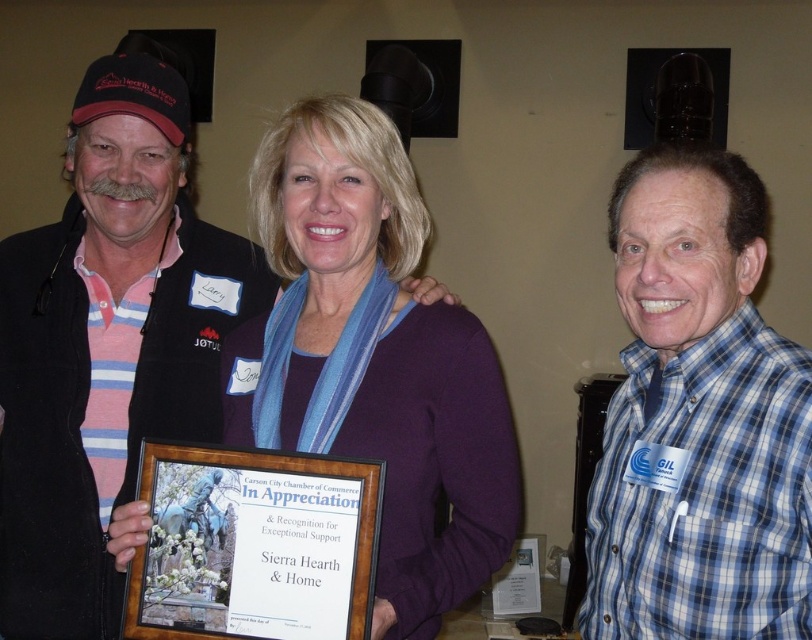
Is blue plaid shirt at right below purple fabric scarf at center?

Correct, blue plaid shirt at right is located below purple fabric scarf at center.

Describe the element at coordinates (698, 419) in the screenshot. The height and width of the screenshot is (640, 812). I see `blue plaid shirt at right` at that location.

The width and height of the screenshot is (812, 640). Identify the location of blue plaid shirt at right. (698, 419).

Between point (217, 276) and point (474, 534), which one is positioned behind?

The point (217, 276) is behind.

Which is in front, point (48, 406) or point (225, 396)?

Positioned in front is point (225, 396).

At what (x,y) coordinates should I click in order to perform the action: click on striped polo shirt at left. Please return your answer as a coordinate pair (x, y). The height and width of the screenshot is (640, 812). Looking at the image, I should click on (106, 342).

Does striped polo shirt at left have a greater height compared to blue plaid shirt at right?

Indeed, striped polo shirt at left has a greater height compared to blue plaid shirt at right.

Is striped polo shirt at left closer to camera compared to blue plaid shirt at right?

No, it is not.

This screenshot has width=812, height=640. What do you see at coordinates (106, 342) in the screenshot?
I see `striped polo shirt at left` at bounding box center [106, 342].

The height and width of the screenshot is (640, 812). Find the location of `striped polo shirt at left`. striped polo shirt at left is located at coordinates (106, 342).